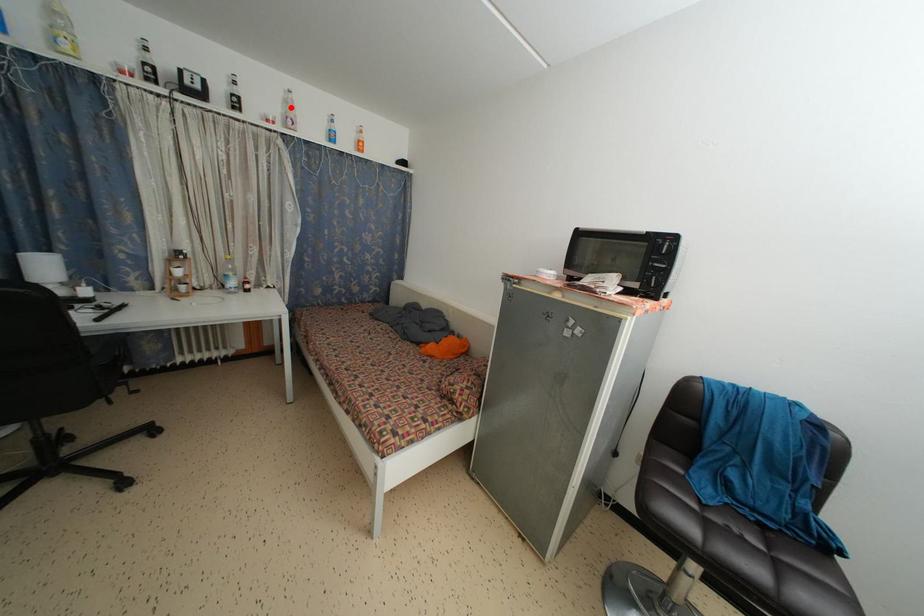
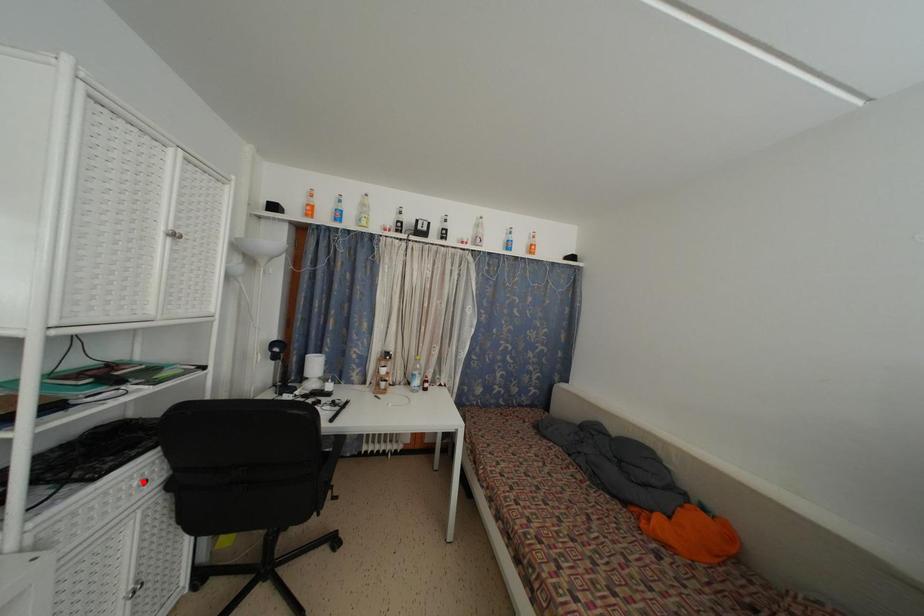
I am providing you with two images of the same scene from different viewpoints. A red point is marked on the first image and another point is marked on the second image. Is the red point in image1 aligned with the point shown in image2?

No